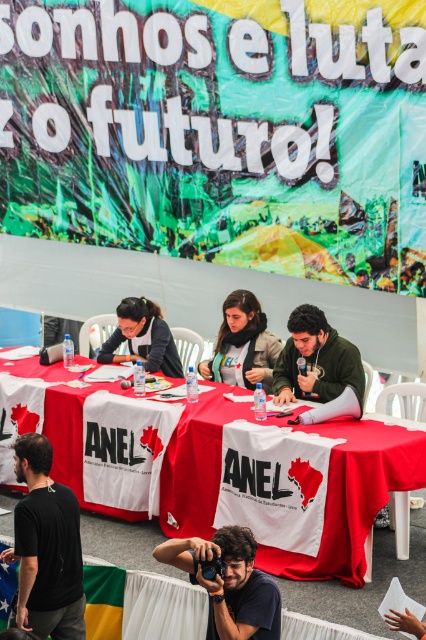
Question: Based on their relative distances, which object is nearer to the red fabric tablecloth at center?

Choices:
 (A) green textured sweater at center
 (B) matte black jacket at center
 (C) dark brown leather camera at lower center
 (D) black t-shirt at center

Answer: (A)

Question: Where is dark brown leather camera at lower center located in relation to black matte microphone at center in the image?

Choices:
 (A) above
 (B) below

Answer: (B)

Question: Which object appears farthest from the camera in this image?

Choices:
 (A) dark brown leather camera at lower center
 (B) black matte microphone at center
 (C) black t-shirt at center

Answer: (B)

Question: Does black t-shirt at center come in front of dark brown leather camera at lower center?

Choices:
 (A) no
 (B) yes

Answer: (A)

Question: Which object is farther from the camera taking this photo?

Choices:
 (A) red fabric tablecloth at center
 (B) green textured sweater at center

Answer: (B)

Question: Is dark brown leather camera at lower center above matte black jacket at center?

Choices:
 (A) yes
 (B) no

Answer: (B)